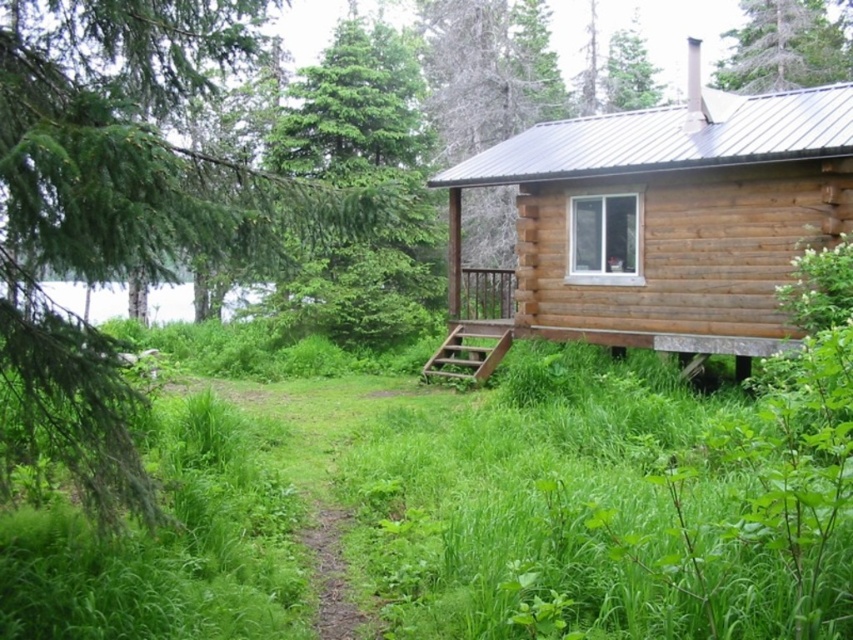
Which is above, green grass at center or green textured tree at upper center?

Positioned higher is green textured tree at upper center.

Between point (749, 529) and point (730, 76), which one is positioned behind?

The point (730, 76) is behind.

Between point (608, 556) and point (770, 72), which one is positioned in front?

Positioned in front is point (608, 556).

This screenshot has height=640, width=853. Identify the location of green grass at center. (476, 512).

Is green grass at center positioned behind green needle-like at left?

Yes.

Who is shorter, green grass at center or green needle-like at left?

green grass at center

Image resolution: width=853 pixels, height=640 pixels. In order to click on green grass at center in this screenshot , I will do `click(476, 512)`.

I want to click on green grass at center, so click(x=476, y=512).

At what (x,y) coordinates should I click in order to perform the action: click on green needle-like at left. Please return your answer as a coordinate pair (x, y). Looking at the image, I should click on (126, 204).

Can you confirm if green needle-like at left is thinner than brown wooden cabin at center?

Correct, green needle-like at left's width is less than brown wooden cabin at center's.

Which is in front, point (107, 480) or point (637, 225)?

Point (107, 480) is more forward.

This screenshot has height=640, width=853. What are the coordinates of `green needle-like at left` in the screenshot? It's located at (126, 204).